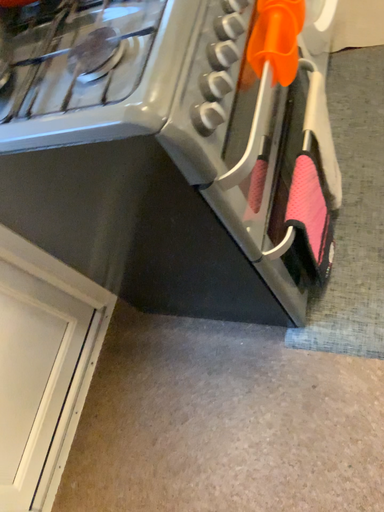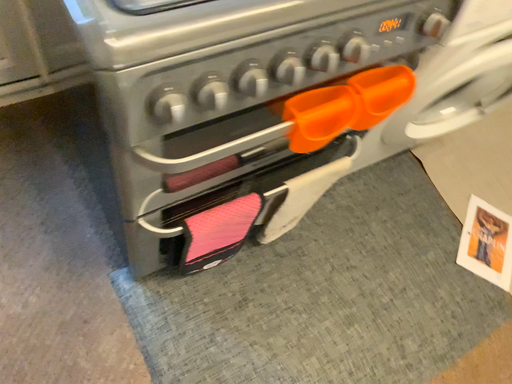
Question: Which way did the camera rotate in the video?

Choices:
 (A) rotated downward
 (B) rotated upward

Answer: (A)